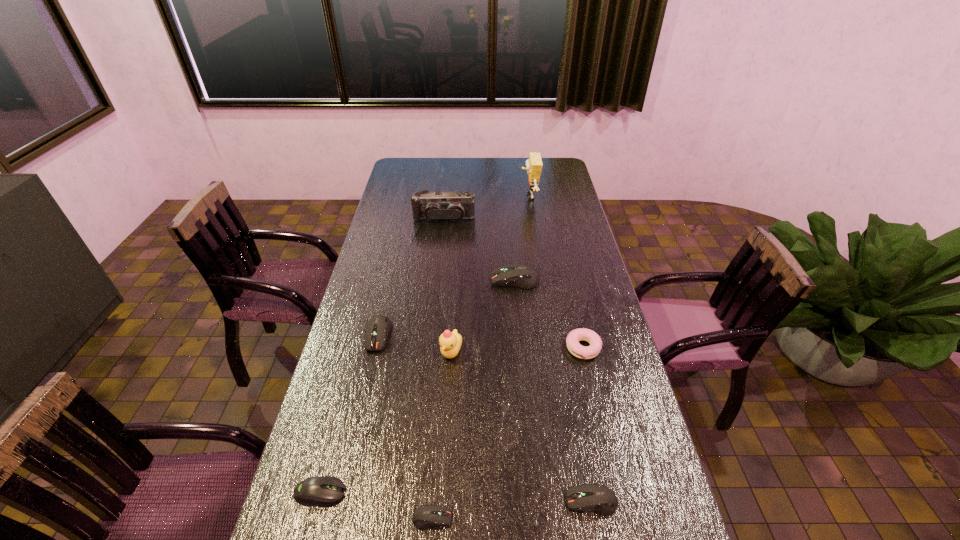
This screenshot has height=540, width=960. What are the coordinates of `camcorder at the left edge` in the screenshot? It's located at (433, 206).

This screenshot has height=540, width=960. What are the coordinates of `doughnut that is positioned at the right edge` in the screenshot? It's located at (575, 348).

Find the location of a particular element. Image resolution: width=960 pixels, height=540 pixels. computer equipment present at the right edge is located at coordinates (596, 498).

Image resolution: width=960 pixels, height=540 pixels. In the image, there is a desktop. What are the coordinates of `free space at the far edge` in the screenshot? It's located at (447, 179).

Where is `vacant space at the left edge of the desktop`? vacant space at the left edge of the desktop is located at coordinates (403, 202).

The image size is (960, 540). In order to click on free space at the right edge in this screenshot , I will do `click(586, 255)`.

At what (x,y) coordinates should I click in order to perform the action: click on vacant point located between the gray computer mouse and the biggest dark computer equipment. Please return your answer as a coordinate pair (x, y). The height and width of the screenshot is (540, 960). Looking at the image, I should click on (418, 387).

Find the location of `empty space between the gray computer mouse and the smallest dark computer equipment`. empty space between the gray computer mouse and the smallest dark computer equipment is located at coordinates (376, 505).

The height and width of the screenshot is (540, 960). Identify the location of free spot between the second farthest dark computer equipment and the shortest object. (405, 427).

Image resolution: width=960 pixels, height=540 pixels. Identify the location of vacant area that lies between the black camcorder and the sponge. point(487,208).